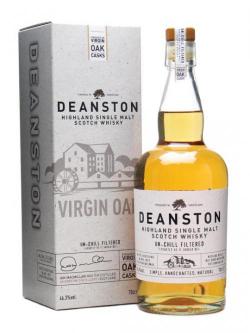
Locate an element on the screen. This screenshot has height=333, width=250. windows is located at coordinates (82, 159), (75, 152).